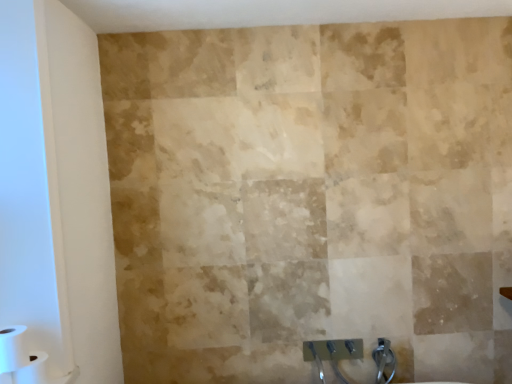
The width and height of the screenshot is (512, 384). What are the coordinates of `white matte toilet paper at lower left, the 2th toilet paper from the top` in the screenshot? It's located at (32, 370).

What do you see at coordinates (13, 348) in the screenshot? I see `white matte toilet paper at lower left, which is the 1th toilet paper in top-to-bottom order` at bounding box center [13, 348].

You are a GUI agent. You are given a task and a screenshot of the screen. Output one action in this format:
    pyautogui.click(x=<x>, y=<y>)
    Task: Click on the transparent glass door at left
    This screenshot has height=384, width=512.
    Given the screenshot: What is the action you would take?
    pyautogui.click(x=30, y=189)

This screenshot has width=512, height=384. Identify the location of white matte toilet paper at lower left, the 2th toilet paper from the top. (32, 370).

From a real-world perspective, is white matte toilet paper at lower left, arranged as the 1th toilet paper when ordered from the bottom, physically below transparent glass door at left?

Indeed, from a real-world perspective, white matte toilet paper at lower left, arranged as the 1th toilet paper when ordered from the bottom, is positioned beneath transparent glass door at left.

From the image's perspective, does white matte toilet paper at lower left, the 2th toilet paper from the top, appear higher than transparent glass door at left?

No, from the image's perspective, white matte toilet paper at lower left, the 2th toilet paper from the top, is not on top of transparent glass door at left.

Could you tell me if white matte toilet paper at lower left, arranged as the 1th toilet paper when ordered from the bottom, is facing transparent glass door at left?

Yes, white matte toilet paper at lower left, arranged as the 1th toilet paper when ordered from the bottom, is aimed at transparent glass door at left.

Consider the image. Considering the sizes of white matte toilet paper at lower left, arranged as the 1th toilet paper when ordered from the bottom, and transparent glass door at left in the image, is white matte toilet paper at lower left, arranged as the 1th toilet paper when ordered from the bottom, wider or thinner than transparent glass door at left?

Clearly, white matte toilet paper at lower left, arranged as the 1th toilet paper when ordered from the bottom, has more width compared to transparent glass door at left.

Which is in front, point (40, 159) or point (46, 374)?

Point (40, 159)

Between transparent glass door at left and white matte toilet paper at lower left, arranged as the 1th toilet paper when ordered from the bottom, which one has larger width?

Wider between the two is white matte toilet paper at lower left, arranged as the 1th toilet paper when ordered from the bottom.

Based on the photo, is transparent glass door at left inside the boundaries of white matte toilet paper at lower left, the 2th toilet paper from the top, or outside?

transparent glass door at left is not inside white matte toilet paper at lower left, the 2th toilet paper from the top, it's outside.

Considering the sizes of objects transparent glass door at left and white matte toilet paper at lower left, arranged as the 1th toilet paper when ordered from the bottom, in the image provided, who is shorter, transparent glass door at left or white matte toilet paper at lower left, arranged as the 1th toilet paper when ordered from the bottom,?

white matte toilet paper at lower left, arranged as the 1th toilet paper when ordered from the bottom, is shorter.

Would you say transparent glass door at left contains white matte toilet paper at lower left, which appears as the 2th toilet paper when ordered from the bottom?

Definitely not — white matte toilet paper at lower left, which appears as the 2th toilet paper when ordered from the bottom, is not inside transparent glass door at left.

Is transparent glass door at left beside white matte toilet paper at lower left, which is the 1th toilet paper in top-to-bottom order?

transparent glass door at left and white matte toilet paper at lower left, which is the 1th toilet paper in top-to-bottom order, are not in contact.

Looking at this image, from the image's perspective, relative to white matte toilet paper at lower left, which appears as the 2th toilet paper when ordered from the bottom, is transparent glass door at left above or below?

Clearly, from the image's perspective, transparent glass door at left is above white matte toilet paper at lower left, which appears as the 2th toilet paper when ordered from the bottom.

In the scene shown: Which of these two, transparent glass door at left or white matte toilet paper at lower left, which appears as the 2th toilet paper when ordered from the bottom, stands taller?

Standing taller between the two is transparent glass door at left.

Considering the points (40, 360) and (12, 332), which point is in front, point (40, 360) or point (12, 332)?

Positioned in front is point (12, 332).

I want to click on toilet paper that is on the right side of white matte toilet paper at lower left, which appears as the 2th toilet paper when ordered from the bottom, so click(x=32, y=370).

In the scene shown: Considering the positions of objects white matte toilet paper at lower left, the 2th toilet paper from the top, and white matte toilet paper at lower left, which is the 1th toilet paper in top-to-bottom order, in the image provided, who is in front, white matte toilet paper at lower left, the 2th toilet paper from the top, or white matte toilet paper at lower left, which is the 1th toilet paper in top-to-bottom order,?

Positioned in front is white matte toilet paper at lower left, which is the 1th toilet paper in top-to-bottom order.

Is point (25, 348) behind point (28, 372)?

Yes, point (25, 348) is farther from viewer.

Based on the photo, from the image's perspective, is white matte toilet paper at lower left, which is the 1th toilet paper in top-to-bottom order, over white matte toilet paper at lower left, arranged as the 1th toilet paper when ordered from the bottom?

Correct, white matte toilet paper at lower left, which is the 1th toilet paper in top-to-bottom order, appears higher than white matte toilet paper at lower left, arranged as the 1th toilet paper when ordered from the bottom, in the image.

Can you tell me how much white matte toilet paper at lower left, which appears as the 2th toilet paper when ordered from the bottom, and white matte toilet paper at lower left, arranged as the 1th toilet paper when ordered from the bottom, differ in facing direction?

The angle between the facing direction of white matte toilet paper at lower left, which appears as the 2th toilet paper when ordered from the bottom, and the facing direction of white matte toilet paper at lower left, arranged as the 1th toilet paper when ordered from the bottom, is 0.0138 degrees.

Could you tell me if white matte toilet paper at lower left, which is the 1th toilet paper in top-to-bottom order, is turned towards white matte toilet paper at lower left, arranged as the 1th toilet paper when ordered from the bottom?

No, white matte toilet paper at lower left, which is the 1th toilet paper in top-to-bottom order, is not aimed at white matte toilet paper at lower left, arranged as the 1th toilet paper when ordered from the bottom.

Could you tell me if white matte toilet paper at lower left, which appears as the 2th toilet paper when ordered from the bottom, is facing transparent glass door at left?

Yes, white matte toilet paper at lower left, which appears as the 2th toilet paper when ordered from the bottom, is turned towards transparent glass door at left.

In the scene shown: Considering the relative sizes of white matte toilet paper at lower left, which is the 1th toilet paper in top-to-bottom order, and transparent glass door at left in the image provided, is white matte toilet paper at lower left, which is the 1th toilet paper in top-to-bottom order, taller than transparent glass door at left?

No.

From a real-world perspective, is white matte toilet paper at lower left, which appears as the 2th toilet paper when ordered from the bottom, physically above transparent glass door at left?

Incorrect, from a real-world perspective, white matte toilet paper at lower left, which appears as the 2th toilet paper when ordered from the bottom, is lower than transparent glass door at left.

Between white matte toilet paper at lower left, which is the 1th toilet paper in top-to-bottom order, and transparent glass door at left, which one has larger width?

Wider between the two is white matte toilet paper at lower left, which is the 1th toilet paper in top-to-bottom order.

The height and width of the screenshot is (384, 512). I want to click on glass door above the white matte toilet paper at lower left, arranged as the 1th toilet paper when ordered from the bottom (from a real-world perspective), so click(x=30, y=189).

From the image's perspective, which toilet paper is the 2nd one below the transparent glass door at left? Please provide its 2D coordinates.

[(32, 370)]

From the image, which object appears to be farther from transparent glass door at left, white matte toilet paper at lower left, the 2th toilet paper from the top, or white matte toilet paper at lower left, which appears as the 2th toilet paper when ordered from the bottom?

white matte toilet paper at lower left, the 2th toilet paper from the top, lies further to transparent glass door at left than the other object.

From the image, which object appears to be nearer to white matte toilet paper at lower left, which is the 1th toilet paper in top-to-bottom order, transparent glass door at left or white matte toilet paper at lower left, the 2th toilet paper from the top?

white matte toilet paper at lower left, the 2th toilet paper from the top, is positioned closer to the anchor white matte toilet paper at lower left, which is the 1th toilet paper in top-to-bottom order.

Considering their positions, is white matte toilet paper at lower left, which appears as the 2th toilet paper when ordered from the bottom, positioned closer to transparent glass door at left than white matte toilet paper at lower left, the 2th toilet paper from the top?

Based on the image, white matte toilet paper at lower left, which appears as the 2th toilet paper when ordered from the bottom, appears to be nearer to transparent glass door at left.

Considering their positions, is white matte toilet paper at lower left, the 2th toilet paper from the top, positioned further to white matte toilet paper at lower left, which is the 1th toilet paper in top-to-bottom order, than transparent glass door at left?

The object further to white matte toilet paper at lower left, which is the 1th toilet paper in top-to-bottom order, is transparent glass door at left.

From the image, which object appears to be farther from white matte toilet paper at lower left, arranged as the 1th toilet paper when ordered from the bottom, transparent glass door at left or white matte toilet paper at lower left, which appears as the 2th toilet paper when ordered from the bottom?

Among the two, transparent glass door at left is located further to white matte toilet paper at lower left, arranged as the 1th toilet paper when ordered from the bottom.

Based on their spatial positions, is white matte toilet paper at lower left, which appears as the 2th toilet paper when ordered from the bottom, or transparent glass door at left further from white matte toilet paper at lower left, arranged as the 1th toilet paper when ordered from the bottom?

transparent glass door at left lies further to white matte toilet paper at lower left, arranged as the 1th toilet paper when ordered from the bottom, than the other object.

This screenshot has width=512, height=384. Find the location of `toilet paper between transparent glass door at left and white matte toilet paper at lower left, the 2th toilet paper from the top, vertically`. toilet paper between transparent glass door at left and white matte toilet paper at lower left, the 2th toilet paper from the top, vertically is located at coordinates (13, 348).